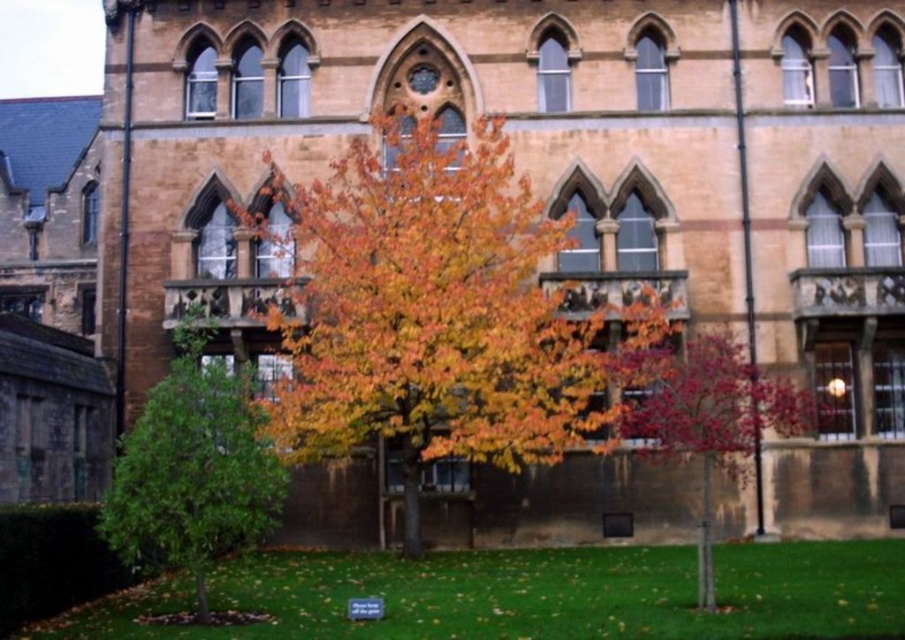
You are a photographer planning to capture the historic building with its surroundings. You want to ensure both the multicolored foliage at center and the green leafy tree at lower left are visible in your shot. Given that the camera frame can only accommodate one larger object, which object should you prioritize to ensure it fits within the frame?

The multicolored foliage at center should be prioritized as it is bigger than the green leafy tree at lower left, making it more likely to fit within the camera frame.

You are a gardener trying to determine which part of the tree has a wider spread. Which has a larger width between the multicolored foliage at center and the shiny red leaves at center?

The multicolored foliage at center might be wider than the shiny red leaves at center.